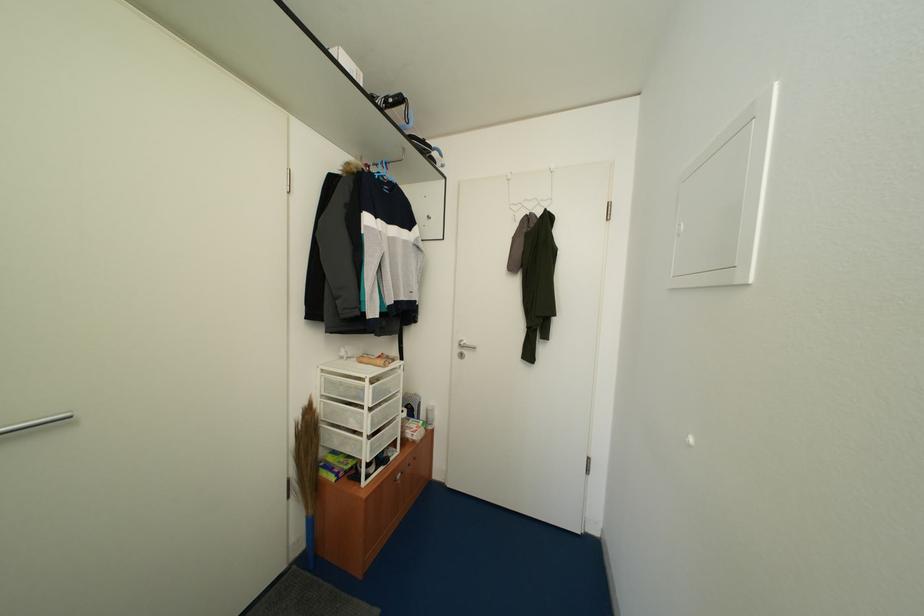
What are the coordinates of `silver cabinet handle` in the screenshot? It's located at (397, 476).